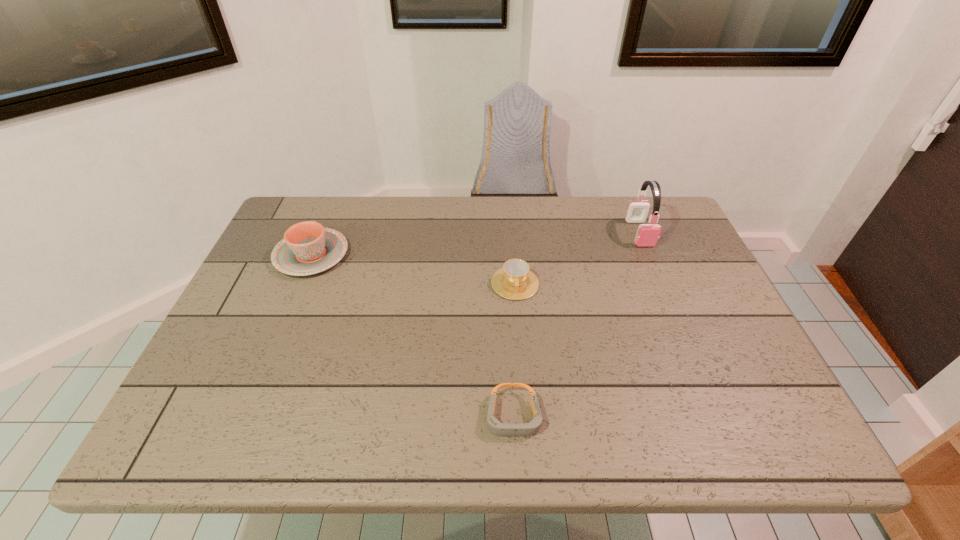
Identify the location of the rightmost object. The image size is (960, 540). (647, 235).

Find the location of `earphone`. earphone is located at coordinates (647, 235).

I want to click on the leftmost object, so click(x=308, y=248).

Find the location of `the second tallest object`. the second tallest object is located at coordinates (308, 248).

Identify the location of cup. Image resolution: width=960 pixels, height=540 pixels. (515, 281).

At what (x,y) coordinates should I click in order to perform the action: click on goggles. Please return your answer as a coordinate pair (x, y). This screenshot has height=540, width=960. Looking at the image, I should click on (495, 426).

Find the location of a particular element. the shortest object is located at coordinates (495, 426).

Find the location of a particular element. Image resolution: width=960 pixels, height=540 pixels. vacant space positioned on the outer surface of the earphone is located at coordinates (656, 271).

Image resolution: width=960 pixels, height=540 pixels. Identify the location of vacant space located on the handle side of the third shortest object. (333, 204).

Where is `blank space located on the handle side of the third shortest object`? blank space located on the handle side of the third shortest object is located at coordinates (333, 202).